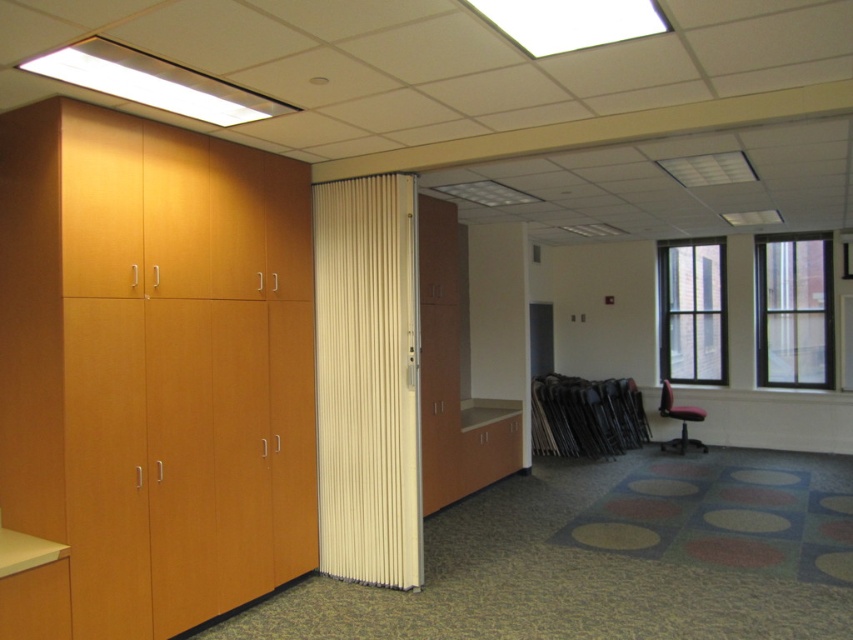
Does matte wood cabinet at left appear on the left side of red fabric chair at right?

Indeed, matte wood cabinet at left is positioned on the left side of red fabric chair at right.

Which of these two, matte wood cabinet at left or red fabric chair at right, stands taller?

Standing taller between the two is matte wood cabinet at left.

Where is `matte wood cabinet at left`? matte wood cabinet at left is located at coordinates (155, 364).

Describe the element at coordinates (367, 380) in the screenshot. I see `white fabric curtain at center` at that location.

Is white fabric curtain at center further to the viewer compared to red fabric chair at right?

No, white fabric curtain at center is closer to the viewer.

Is point (370, 272) farther from camera compared to point (671, 396)?

No, (370, 272) is closer to viewer.

Identify the location of white fabric curtain at center. This screenshot has width=853, height=640. [367, 380].

What do you see at coordinates (155, 364) in the screenshot? The image size is (853, 640). I see `matte wood cabinet at left` at bounding box center [155, 364].

This screenshot has width=853, height=640. In order to click on matte wood cabinet at left in this screenshot , I will do `click(155, 364)`.